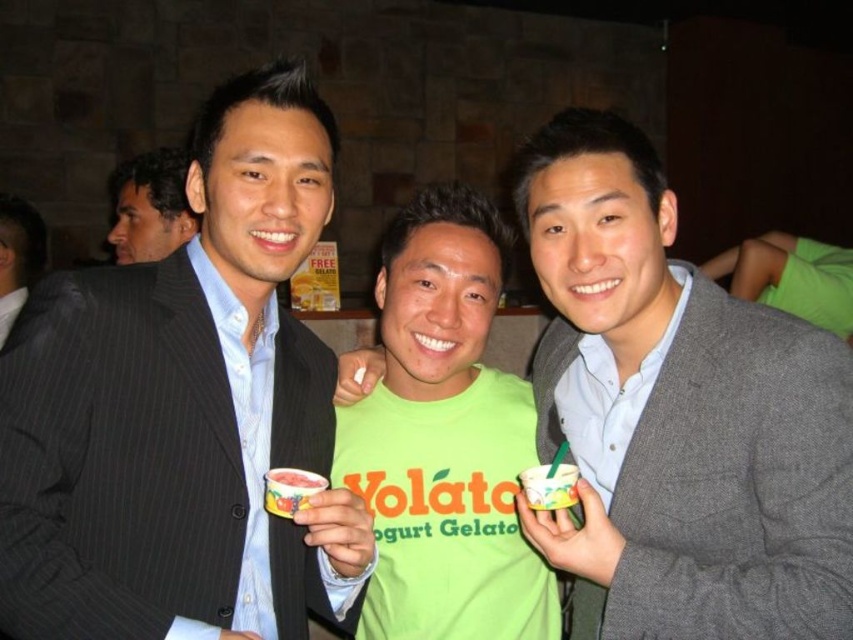
Question: Where is white plastic cup at center located in relation to smooth strawberry yogurt gelato at center in the image?

Choices:
 (A) below
 (B) above

Answer: (B)

Question: Which object is the farthest from the green matte shirt at center?

Choices:
 (A) gray wool suit at center
 (B) matte black suit at left

Answer: (B)

Question: Considering the relative positions of matte black suit at center and gray wool suit at center in the image provided, where is matte black suit at center located with respect to gray wool suit at center?

Choices:
 (A) above
 (B) below

Answer: (A)

Question: Which point is farther to the camera?

Choices:
 (A) (288, 513)
 (B) (271, 372)
 (C) (318, 484)

Answer: (B)

Question: Does matte black suit at left have a smaller size compared to white plastic cup at center?

Choices:
 (A) no
 (B) yes

Answer: (A)

Question: Which point is farther to the camera?

Choices:
 (A) smooth strawberry yogurt gelato at center
 (B) white plastic cup at center
 (C) smooth creamy yogurt cup at center

Answer: (B)